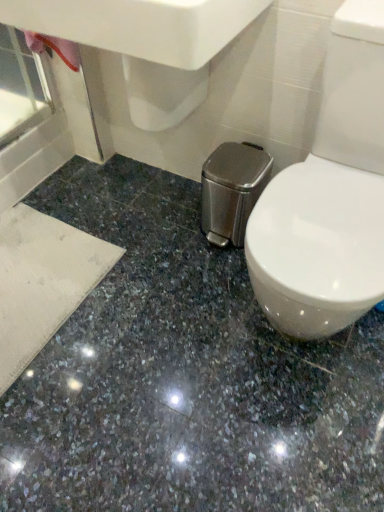
Image resolution: width=384 pixels, height=512 pixels. Find the location of `white glossy sink at upper center`. white glossy sink at upper center is located at coordinates (140, 25).

Describe the element at coordinates (140, 25) in the screenshot. This screenshot has height=512, width=384. I see `white glossy sink at upper center` at that location.

You are a GUI agent. You are given a task and a screenshot of the screen. Output one action in this format:
    pyautogui.click(x=<x>, y=<y>)
    Task: Click on the shiny granite floor at center
    Image resolution: width=384 pixels, height=512 pixels.
    Given the screenshot: What is the action you would take?
    pyautogui.click(x=184, y=376)

This screenshot has height=512, width=384. Describe the element at coordinates (184, 376) in the screenshot. I see `shiny granite floor at center` at that location.

Find the location of a particular element. The image size is (384, 512). white glossy sink at upper center is located at coordinates (140, 25).

Is white glossy sink at upper center at the left side of shiny granite floor at center?

Indeed, white glossy sink at upper center is positioned on the left side of shiny granite floor at center.

Is white glossy sink at upper center further to the viewer compared to shiny granite floor at center?

Yes, white glossy sink at upper center is further from the camera.

Does point (79, 21) appear closer or farther from the camera than point (0, 416)?

Clearly, point (79, 21) is closer to the camera than point (0, 416).

From the image's perspective, between white glossy sink at upper center and shiny granite floor at center, which one is located above?

white glossy sink at upper center, from the image's perspective.

From a real-world perspective, relative to shiny granite floor at center, is white glossy sink at upper center vertically above or below?

white glossy sink at upper center is above shiny granite floor at center.

Is white glossy sink at upper center thinner than shiny granite floor at center?

Yes.

Considering the sizes of objects white glossy sink at upper center and shiny granite floor at center in the image provided, who is taller, white glossy sink at upper center or shiny granite floor at center?

white glossy sink at upper center is taller.

Does white glossy sink at upper center have a larger size compared to shiny granite floor at center?

Yes.

Could shiny granite floor at center be considered to be inside white glossy sink at upper center?

No.

Is white glossy sink at upper center far away from shiny granite floor at center?

No, white glossy sink at upper center is not far away from shiny granite floor at center.

Does white glossy sink at upper center turn towards shiny granite floor at center?

No.

This screenshot has height=512, width=384. I want to click on granite located underneath the white glossy sink at upper center (from a real-world perspective), so click(x=184, y=376).

Which object is positioned more to the left, shiny granite floor at center or white glossy sink at upper center?

Positioned to the left is white glossy sink at upper center.

Looking at this image, is shiny granite floor at center in front of or behind white glossy sink at upper center in the image?

shiny granite floor at center is in front of white glossy sink at upper center.

Is point (262, 360) in front of point (133, 33)?

No, it is not.

In the scene shown: From the image's perspective, which one is positioned lower, shiny granite floor at center or white glossy sink at upper center?

shiny granite floor at center, from the image's perspective.

From a real-world perspective, between shiny granite floor at center and white glossy sink at upper center, who is vertically lower?

shiny granite floor at center, from a real-world perspective.

Can you confirm if shiny granite floor at center is wider than white glossy sink at upper center?

Yes.

Who is shorter, shiny granite floor at center or white glossy sink at upper center?

With less height is shiny granite floor at center.

Can you confirm if shiny granite floor at center is bigger than white glossy sink at upper center?

No, shiny granite floor at center is not bigger than white glossy sink at upper center.

Is shiny granite floor at center inside the boundaries of white glossy sink at upper center, or outside?

shiny granite floor at center is not inside white glossy sink at upper center, it's outside.

Are shiny granite floor at center and white glossy sink at upper center making contact?

shiny granite floor at center is not next to white glossy sink at upper center, and they're not touching.

Is shiny granite floor at center looking in the opposite direction of white glossy sink at upper center?

shiny granite floor at center is not turned away from white glossy sink at upper center.

How different are the orientations of shiny granite floor at center and white glossy sink at upper center in degrees?

89.8 degrees.

Measure the distance between shiny granite floor at center and white glossy sink at upper center.

A distance of 31.89 inches exists between shiny granite floor at center and white glossy sink at upper center.

Where is `granite below the white glossy sink at upper center (from the image's perspective)`? This screenshot has height=512, width=384. granite below the white glossy sink at upper center (from the image's perspective) is located at coordinates (184, 376).

Where is `sink above the shiny granite floor at center (from a real-world perspective)`? sink above the shiny granite floor at center (from a real-world perspective) is located at coordinates (140, 25).

Locate an element on the screen. granite on the right of white glossy sink at upper center is located at coordinates (184, 376).